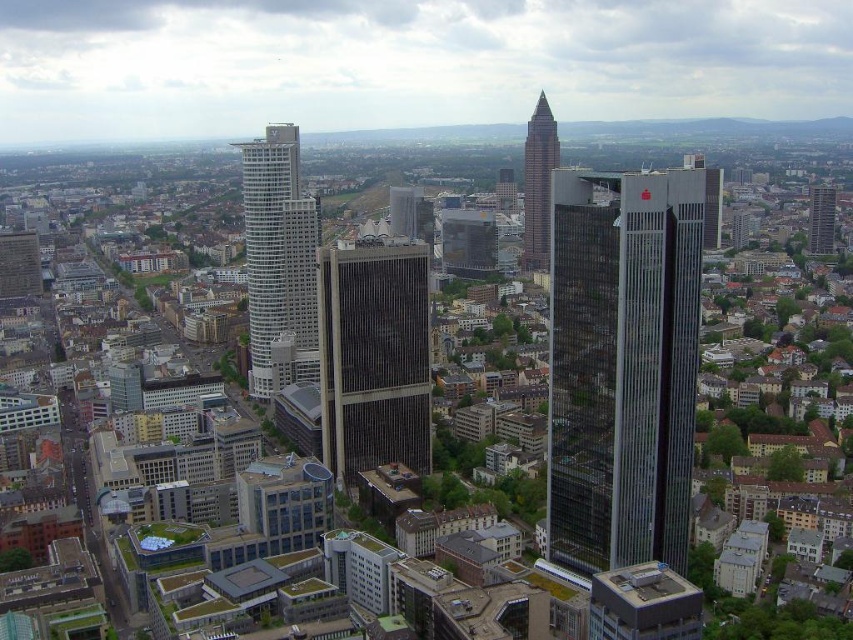
Can you confirm if silver glass skyscraper at center-left is positioned to the left of glassy brown skyscraper at center?

Correct, you'll find silver glass skyscraper at center-left to the left of glassy brown skyscraper at center.

Is point (300, 291) farther from camera compared to point (546, 186)?

No, (300, 291) is closer to viewer.

Identify the location of silver glass skyscraper at center-left. This screenshot has width=853, height=640. (279, 260).

What do you see at coordinates (622, 365) in the screenshot?
I see `glassy gray skyscraper at center` at bounding box center [622, 365].

In the scene shown: Who is more forward, (589, 356) or (524, 195)?

Point (589, 356) is more forward.

The height and width of the screenshot is (640, 853). I want to click on glassy gray skyscraper at center, so click(x=622, y=365).

Which of these two, dark gray glass skyscraper at center or silver glass skyscraper at center-left, stands shorter?

dark gray glass skyscraper at center is shorter.

Is the position of dark gray glass skyscraper at center less distant than that of silver glass skyscraper at center-left?

Yes, dark gray glass skyscraper at center is in front of silver glass skyscraper at center-left.

The image size is (853, 640). What do you see at coordinates (373, 356) in the screenshot?
I see `dark gray glass skyscraper at center` at bounding box center [373, 356].

What are the coordinates of `dark gray glass skyscraper at center` in the screenshot? It's located at (373, 356).